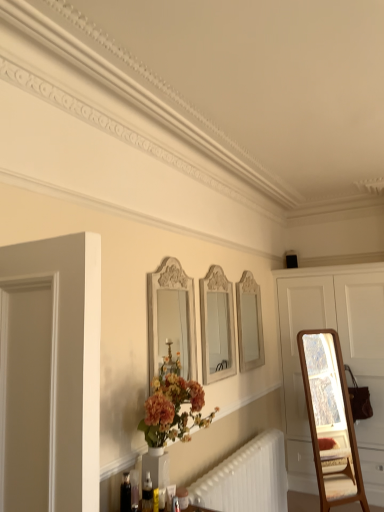
Question: Should I look upward or downward to see white carved wood mirror at center, the first mirror when ordered from left to right?

Choices:
 (A) up
 (B) down

Answer: (B)

Question: Is white glossy mirror at center, which is the second mirror from right to left, far from white carved wood mirror at center, the first mirror in the front-to-back sequence?

Choices:
 (A) yes
 (B) no

Answer: (B)

Question: From a real-world perspective, is white glossy mirror at center, the second mirror in the front-to-back sequence, beneath white carved wood mirror at center, which ranks as the 3th mirror in right-to-left order?

Choices:
 (A) no
 (B) yes

Answer: (B)

Question: Is white glossy mirror at center, the second mirror in the left-to-right sequence, positioned before white carved wood mirror at center, which ranks as the 3th mirror in right-to-left order?

Choices:
 (A) yes
 (B) no

Answer: (B)

Question: From the image's perspective, is white glossy mirror at center, which is the second mirror from right to left, located beneath white carved wood mirror at center, the first mirror in the front-to-back sequence?

Choices:
 (A) yes
 (B) no

Answer: (A)

Question: Is white glossy mirror at center, the second mirror in the left-to-right sequence, further to the viewer compared to white carved wood mirror at center, the first mirror in the front-to-back sequence?

Choices:
 (A) no
 (B) yes

Answer: (B)

Question: From a real-world perspective, is white glossy mirror at center, which is the 2th mirror from back to front, located higher than white carved wood mirror at center, the third mirror from the back?

Choices:
 (A) yes
 (B) no

Answer: (B)

Question: From the image's perspective, is white glossy mirror at upper center, which is counted as the first mirror, starting from the right, on white glossy mirror at center, which is the 2th mirror from back to front?

Choices:
 (A) no
 (B) yes

Answer: (A)

Question: Can you confirm if white glossy mirror at upper center, which is the third mirror in front-to-back order, is taller than white glossy mirror at center, which is the second mirror from right to left?

Choices:
 (A) no
 (B) yes

Answer: (A)

Question: Is white glossy mirror at upper center, which is counted as the first mirror, starting from the right, not close to white glossy mirror at center, the second mirror in the front-to-back sequence?

Choices:
 (A) yes
 (B) no

Answer: (B)

Question: Could you tell me if white glossy mirror at upper center, the third mirror from the left, is turned towards white glossy mirror at center, which is the second mirror from right to left?

Choices:
 (A) yes
 (B) no

Answer: (B)

Question: Does white glossy mirror at upper center, which is counted as the first mirror, starting from the right, have a smaller size compared to white glossy mirror at center, the second mirror in the front-to-back sequence?

Choices:
 (A) no
 (B) yes

Answer: (B)

Question: From a real-world perspective, is white glossy mirror at upper center, the third mirror from the left, positioned over white glossy mirror at center, the second mirror in the front-to-back sequence, based on gravity?

Choices:
 (A) no
 (B) yes

Answer: (A)

Question: From a real-world perspective, is white glossy mirror at upper center, marked as the first mirror in a back-to-front arrangement, under translucent plastic bottle at lower center?

Choices:
 (A) no
 (B) yes

Answer: (A)